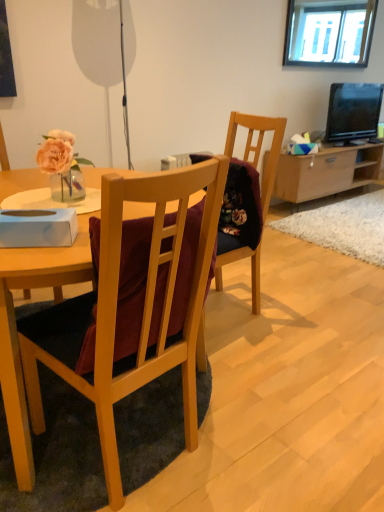
Question: Can you confirm if wooden chair at center is wider than clear glass window at upper center?

Choices:
 (A) yes
 (B) no

Answer: (A)

Question: Does wooden chair at center lie behind clear glass window at upper center?

Choices:
 (A) no
 (B) yes

Answer: (A)

Question: Does wooden chair at center have a larger size compared to clear glass window at upper center?

Choices:
 (A) yes
 (B) no

Answer: (A)

Question: Is clear glass window at upper center a part of wooden chair at center?

Choices:
 (A) no
 (B) yes

Answer: (A)

Question: Is wooden chair at center aimed at clear glass window at upper center?

Choices:
 (A) no
 (B) yes

Answer: (A)

Question: From the image's perspective, is wooden chair at center over clear glass window at upper center?

Choices:
 (A) yes
 (B) no

Answer: (B)

Question: Does clear glass window at upper center have a lesser height compared to matte black television at upper right?

Choices:
 (A) no
 (B) yes

Answer: (A)

Question: Is clear glass window at upper center aimed at matte black television at upper right?

Choices:
 (A) yes
 (B) no

Answer: (B)

Question: Would you say matte black television at upper right is part of clear glass window at upper center's contents?

Choices:
 (A) yes
 (B) no

Answer: (B)

Question: Considering the relative positions of clear glass window at upper center and matte black television at upper right in the image provided, is clear glass window at upper center to the left of matte black television at upper right from the viewer's perspective?

Choices:
 (A) yes
 (B) no

Answer: (A)

Question: Is clear glass window at upper center completely or partially outside of matte black television at upper right?

Choices:
 (A) yes
 (B) no

Answer: (A)

Question: Are clear glass window at upper center and matte black television at upper right beside each other?

Choices:
 (A) no
 (B) yes

Answer: (A)

Question: Is light brown wood cabinet at center right bigger than wooden chair at center?

Choices:
 (A) yes
 (B) no

Answer: (A)